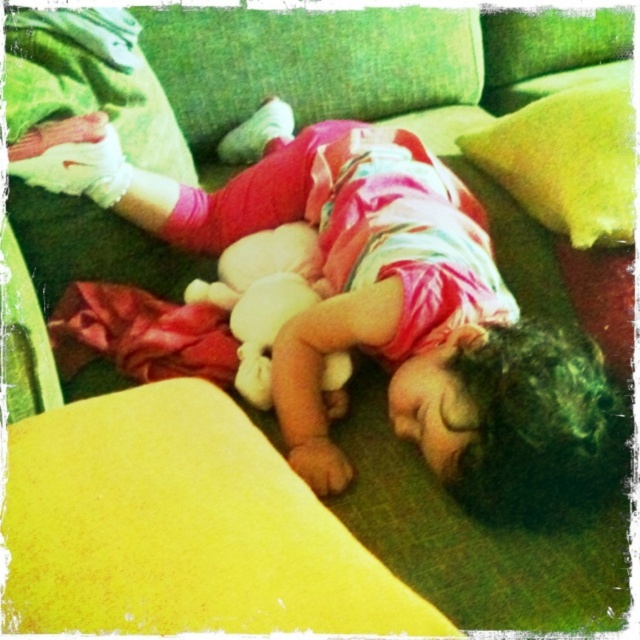
Which is more to the left, soft pink fabric at center or fluffy white teddy bear at center?

fluffy white teddy bear at center is more to the left.

Find the location of a particular element. Image resolution: width=640 pixels, height=640 pixels. soft pink fabric at center is located at coordinates (384, 308).

Describe the element at coordinates (566, 161) in the screenshot. I see `green fabric pillow at upper center` at that location.

Image resolution: width=640 pixels, height=640 pixels. I want to click on green fabric pillow at upper center, so click(x=566, y=161).

Between soft pink fabric at center and green fabric pillow at upper center, which one is positioned higher?

Positioned higher is green fabric pillow at upper center.

The height and width of the screenshot is (640, 640). Find the location of `soft pink fabric at center`. soft pink fabric at center is located at coordinates (384, 308).